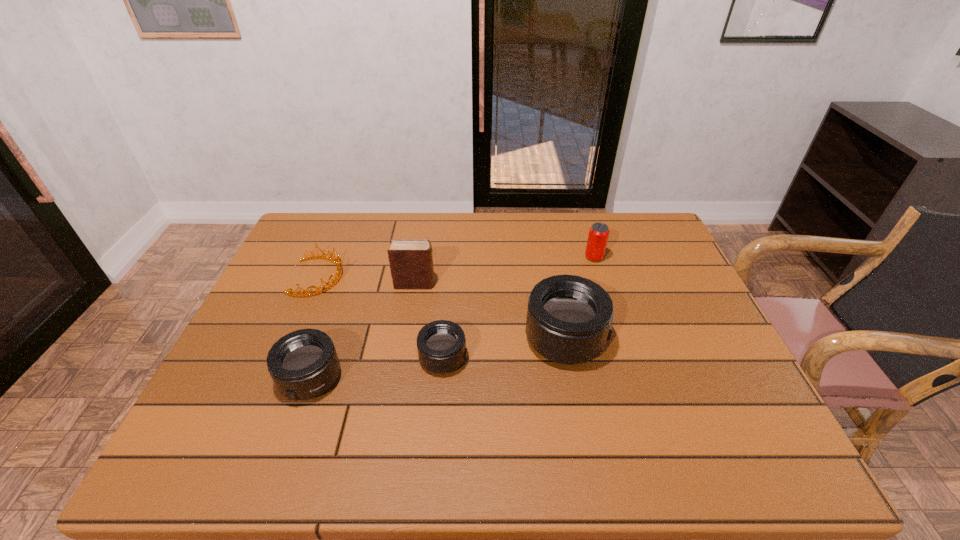
Identify the location of vacant region between the diary and the shortest telephoto lens. Image resolution: width=960 pixels, height=540 pixels. (429, 321).

The width and height of the screenshot is (960, 540). Find the location of `vacant area that lies between the diary and the fourth tallest object`. vacant area that lies between the diary and the fourth tallest object is located at coordinates (363, 332).

Locate an element on the screen. free space between the tiara and the second telephoto lens from left to right is located at coordinates (381, 318).

The height and width of the screenshot is (540, 960). In order to click on vacant space in between the shortest telephoto lens and the tiara in this screenshot , I will do `click(381, 318)`.

The image size is (960, 540). In order to click on free space between the diary and the tiara in this screenshot , I will do `click(367, 280)`.

You are a GUI agent. You are given a task and a screenshot of the screen. Output one action in this format:
    pyautogui.click(x=<x>, y=<y>)
    Task: Click on the object that is the fifth closest to the tiara
    This screenshot has height=540, width=960.
    Given the screenshot: What is the action you would take?
    pyautogui.click(x=598, y=235)

The width and height of the screenshot is (960, 540). In order to click on object that ranks as the third closest to the shortest telephoto lens in this screenshot , I will do `click(411, 262)`.

Select which telephoto lens appears as the second closest to the shortest telephoto lens. Please provide its 2D coordinates. Your answer should be formatted as a tuple, i.e. [(x, y)], where the tuple contains the x and y coordinates of a point satisfying the conditions above.

[(303, 364)]

Where is `telephoto lens that is the closest to the second tallest telephoto lens`? The height and width of the screenshot is (540, 960). telephoto lens that is the closest to the second tallest telephoto lens is located at coordinates (441, 344).

Find the location of a particular element. blank space that satisfies the following two spatial constraints: 1. on the side of the second telephoto lens from left to right with brand markings and control switches; 2. on the side of the second shortest telephoto lens with brand markings and control switches is located at coordinates (442, 379).